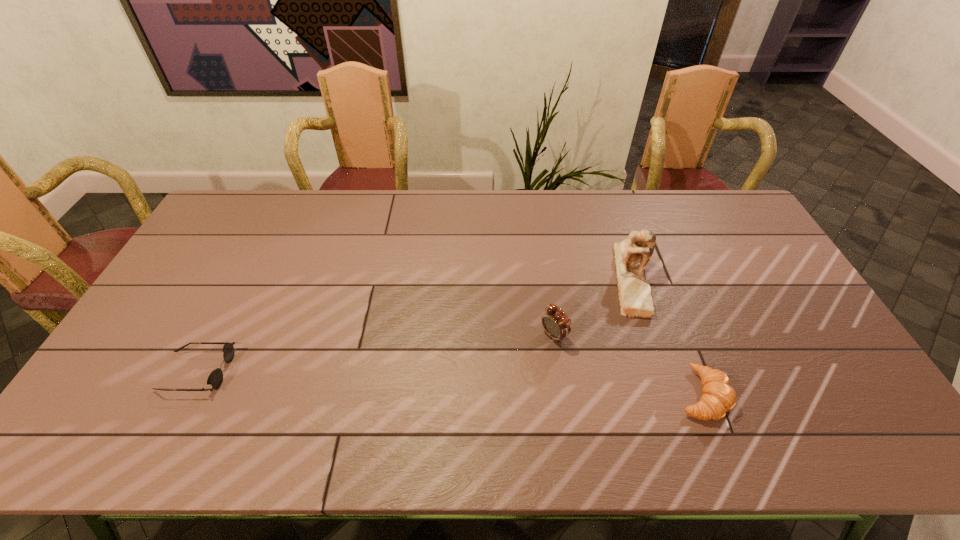
Where is `vacant space located 0.250m on the face of the second tallest object`? The image size is (960, 540). vacant space located 0.250m on the face of the second tallest object is located at coordinates (471, 392).

The width and height of the screenshot is (960, 540). What are the coordinates of `free space located on the face of the second tallest object` in the screenshot? It's located at (502, 371).

In order to click on free space located on the front-facing side of the figurine in this screenshot , I will do `click(599, 318)`.

Locate an element on the screen. This screenshot has height=540, width=960. blank space located 0.200m on the front-facing side of the figurine is located at coordinates (575, 335).

The image size is (960, 540). I want to click on blank space located 0.330m on the front-facing side of the figurine, so coord(540,359).

At what (x,y) coordinates should I click in order to perform the action: click on sunglasses situated at the near edge. Please return your answer as a coordinate pair (x, y). The image size is (960, 540). Looking at the image, I should click on (215, 379).

Where is `crescent roll that is at the near edge`? The image size is (960, 540). crescent roll that is at the near edge is located at coordinates (718, 397).

In order to click on object situated at the left edge in this screenshot , I will do `click(215, 379)`.

This screenshot has width=960, height=540. I want to click on object present at the near left corner, so click(215, 379).

You are a GUI agent. You are given a task and a screenshot of the screen. Output one action in this format:
    pyautogui.click(x=<x>, y=<y>)
    Task: Click on the free point at the far edge
    
    Given the screenshot: What is the action you would take?
    pyautogui.click(x=372, y=212)